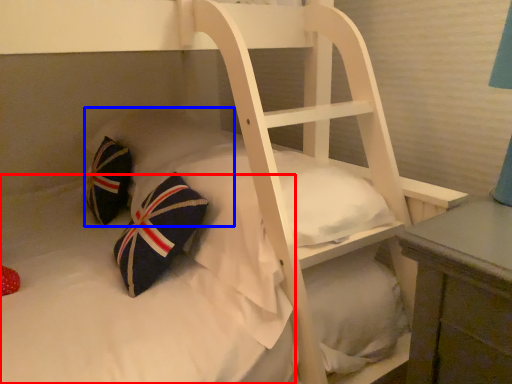
Question: Among these objects, which one is nearest to the camera, mattress (highlighted by a red box) or pillow (highlighted by a blue box)?

Choices:
 (A) mattress
 (B) pillow

Answer: (A)